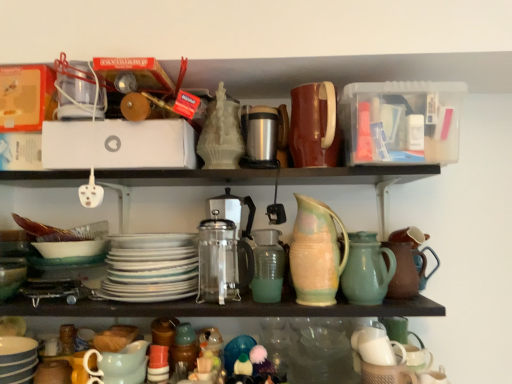
Question: Does satin silver coffee machine at center lie behind white glossy platter at center?

Choices:
 (A) yes
 (B) no

Answer: (A)

Question: Can you confirm if satin silver coffee machine at center is thinner than white glossy platter at center?

Choices:
 (A) no
 (B) yes

Answer: (B)

Question: Is satin silver coffee machine at center facing towards white glossy platter at center?

Choices:
 (A) no
 (B) yes

Answer: (A)

Question: Can white glossy platter at center be found inside satin silver coffee machine at center?

Choices:
 (A) no
 (B) yes

Answer: (A)

Question: Does satin silver coffee machine at center have a greater width compared to white glossy platter at center?

Choices:
 (A) no
 (B) yes

Answer: (A)

Question: Is satin silver coffee machine at center beside white glossy platter at center?

Choices:
 (A) yes
 (B) no

Answer: (B)

Question: Considering the relative sizes of satin silver coffee machine at center and striped ceramic bowls at lower left, acting as the second tableware starting from the bottom, in the image provided, is satin silver coffee machine at center smaller than striped ceramic bowls at lower left, acting as the second tableware starting from the bottom,?

Choices:
 (A) no
 (B) yes

Answer: (A)

Question: Is satin silver coffee machine at center next to striped ceramic bowls at lower left, which ranks as the 2th tableware in top-to-bottom order?

Choices:
 (A) yes
 (B) no

Answer: (B)

Question: From a real-world perspective, is satin silver coffee machine at center positioned over striped ceramic bowls at lower left, the third tableware positioned from the right, based on gravity?

Choices:
 (A) yes
 (B) no

Answer: (A)

Question: Does satin silver coffee machine at center come behind striped ceramic bowls at lower left, the third tableware positioned from the right?

Choices:
 (A) no
 (B) yes

Answer: (B)

Question: Is satin silver coffee machine at center turned away from striped ceramic bowls at lower left, the third tableware positioned from the right?

Choices:
 (A) no
 (B) yes

Answer: (A)

Question: Is satin silver coffee machine at center positioned beyond the bounds of striped ceramic bowls at lower left, which ranks as the 2th tableware in top-to-bottom order?

Choices:
 (A) no
 (B) yes

Answer: (B)

Question: Does satin silver coffee machine at center have a smaller size compared to matte green mixing bowl at lower left?

Choices:
 (A) no
 (B) yes

Answer: (A)